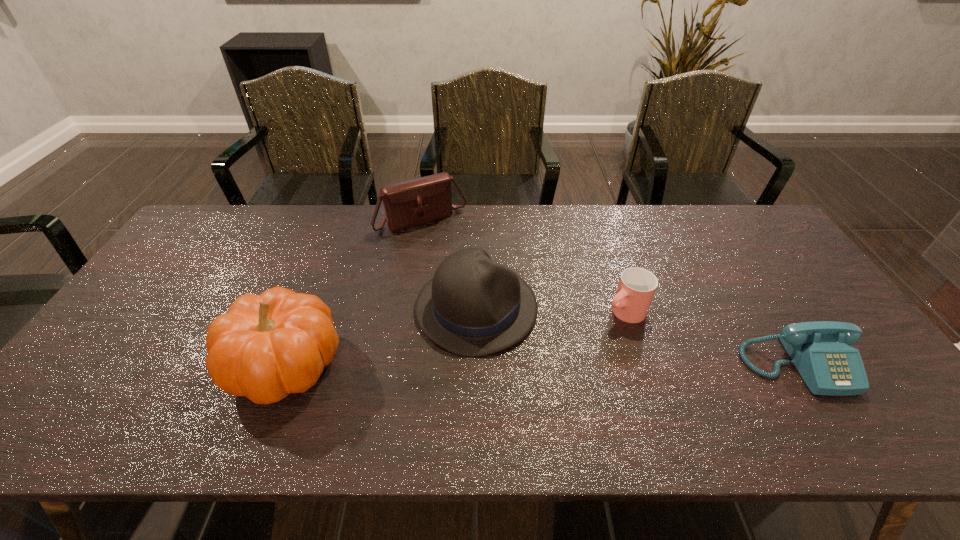
Locate an element on the screen. The height and width of the screenshot is (540, 960). vacant space on the desktop that is between the pumpkin and the telephone and is positioned on the side of the second object from right to left with the handle is located at coordinates (546, 364).

The image size is (960, 540). I want to click on vacant space on the desktop that is between the pumpkin and the shortest object and is positioned on the front-facing side of the bowler hat, so click(x=600, y=364).

Where is `free spot on the desktop that is between the tallest object and the telephone and is positioned on the front flap of the shoulder bag`? This screenshot has height=540, width=960. free spot on the desktop that is between the tallest object and the telephone and is positioned on the front flap of the shoulder bag is located at coordinates [523, 364].